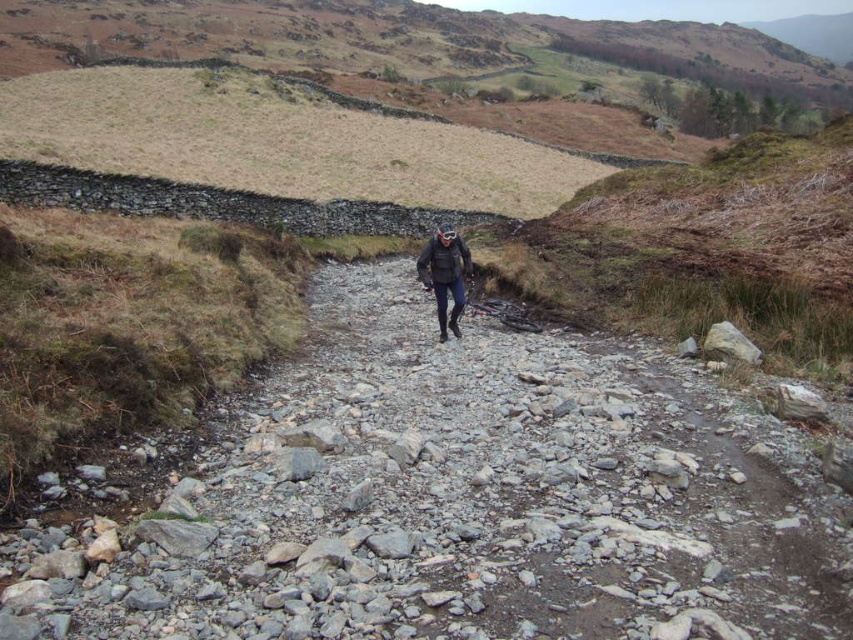
Does gray rocky trail at center appear on the left side of dark gray jacket at center?

No, gray rocky trail at center is not to the left of dark gray jacket at center.

Based on the photo, can you confirm if gray rocky trail at center is positioned above dark gray jacket at center?

Actually, gray rocky trail at center is below dark gray jacket at center.

Where is `gray rocky trail at center`? This screenshot has height=640, width=853. gray rocky trail at center is located at coordinates (461, 499).

The width and height of the screenshot is (853, 640). Find the location of `gray rocky trail at center`. gray rocky trail at center is located at coordinates (461, 499).